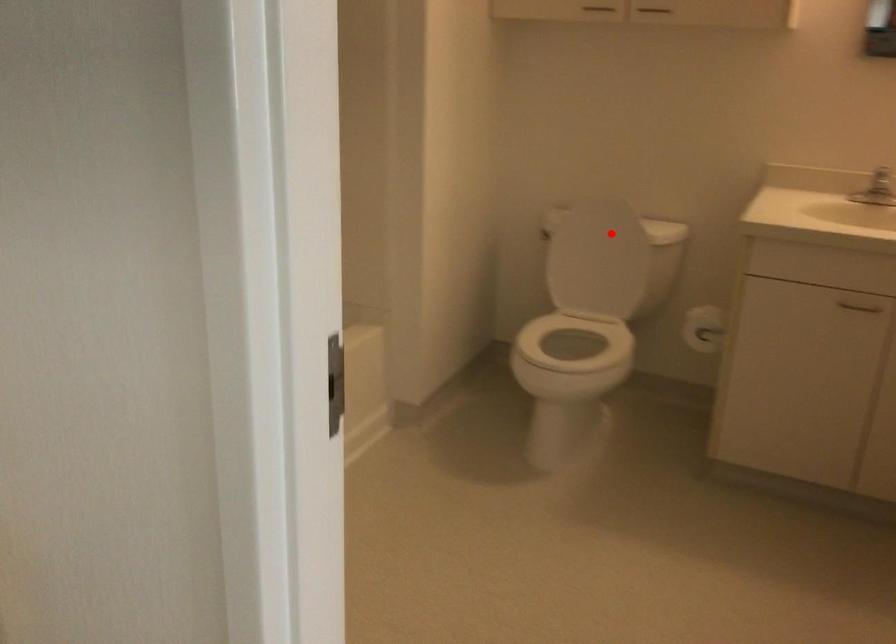
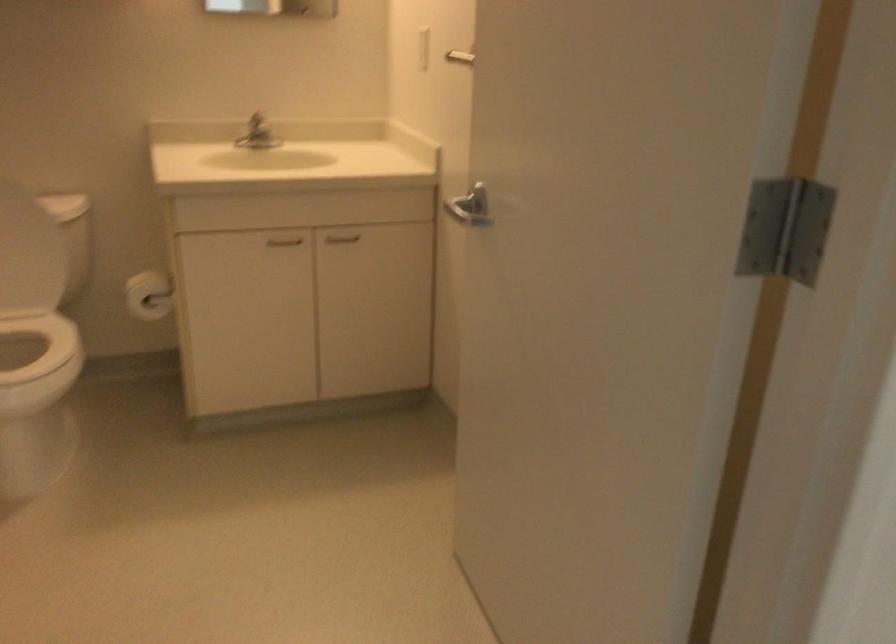
Question: I am providing you with two images of the same scene from different viewpoints. A red point is shown in image1. For the corresponding object point in image2, is it positioned nearer or farther from the camera?

Choices:
 (A) Nearer
 (B) Farther

Answer: (A)